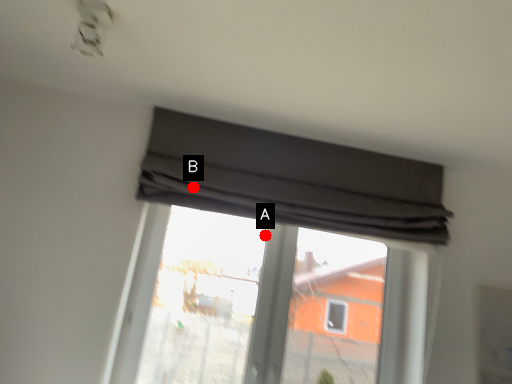
Question: Two points are circled on the image, labeled by A and B beside each circle. Which point is closer to the camera?

Choices:
 (A) A is closer
 (B) B is closer

Answer: (B)